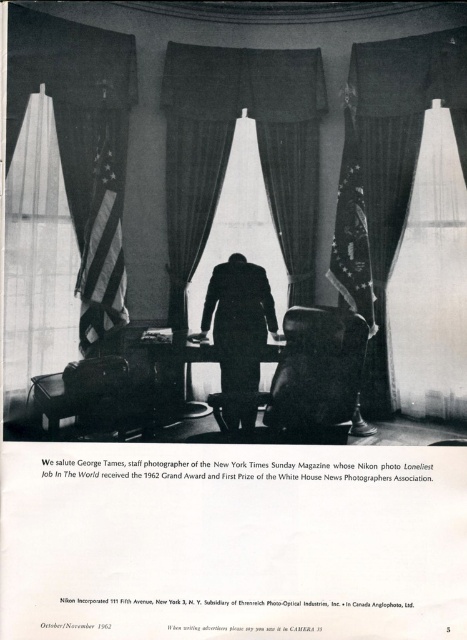
From the picture: You are a security guard in the building and need to check the distance between the black velvet curtains at center and the black suit at center. According to the image, how far apart are they?

The black velvet curtains at center and the black suit at center are 7.14 inches apart from each other.

You are an interior designer tasked with ensuring proper visibility of the American flags in the scene. Considering the translucent fabric curtain at left and the black suit at center, which object is blocking the light from reaching the flags and needs adjustment?

The translucent fabric curtain at left is positioned over the black suit at center, so adjusting the translucent fabric curtain at left would allow more light to reach the American flags.

You are an interior designer working on a project and need to place a new desk in this room. The desk requires a clear space of 1 meter in front of it. Given the velvet dark blue curtain at center is at point 0.267, 0.831, can you confirm if the area in front of the desk will be unobstructed?

The velvet dark blue curtain at center is located at coordinates (388, 170), so placing the desk 1 meter away from it would leave sufficient space in front of the desk to remain unobstructed.